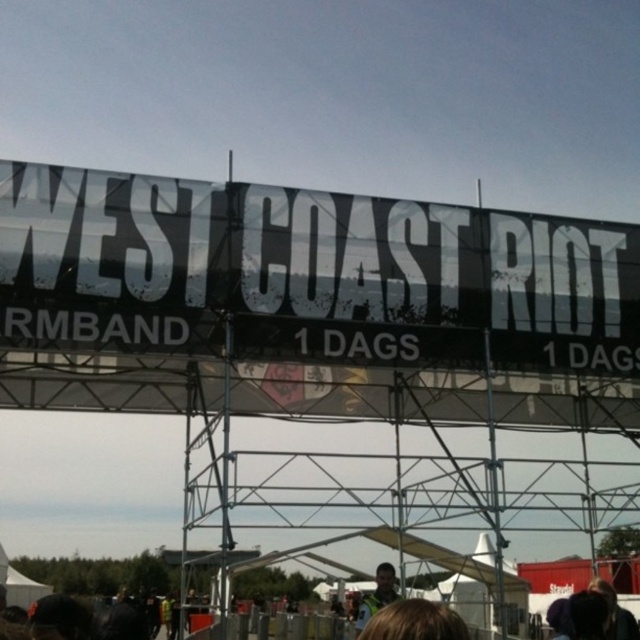
Who is taller, blonde hair at lower center or green fabric jacket at center?

green fabric jacket at center

Can you confirm if blonde hair at lower center is positioned to the left of green fabric jacket at center?

Yes, blonde hair at lower center is to the left of green fabric jacket at center.

The width and height of the screenshot is (640, 640). Describe the element at coordinates (413, 621) in the screenshot. I see `blonde hair at lower center` at that location.

Find the location of a particular element. blonde hair at lower center is located at coordinates coord(413,621).